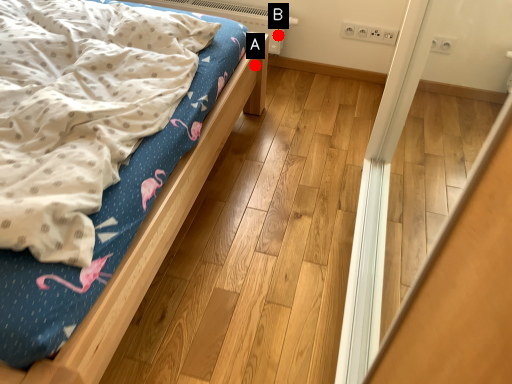
Question: Two points are circled on the image, labeled by A and B beside each circle. Which of the following is the farthest from the observer?

Choices:
 (A) A is further
 (B) B is further

Answer: (B)